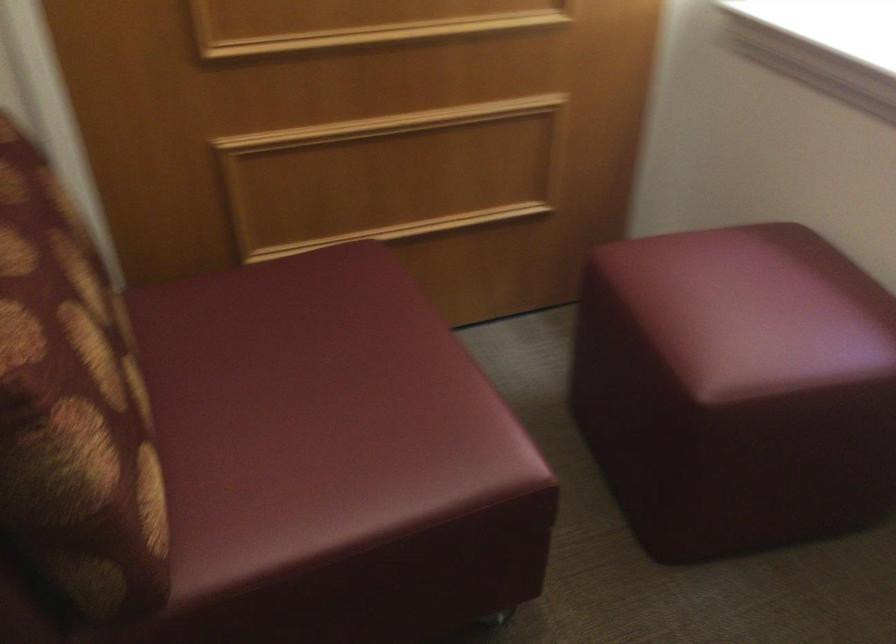
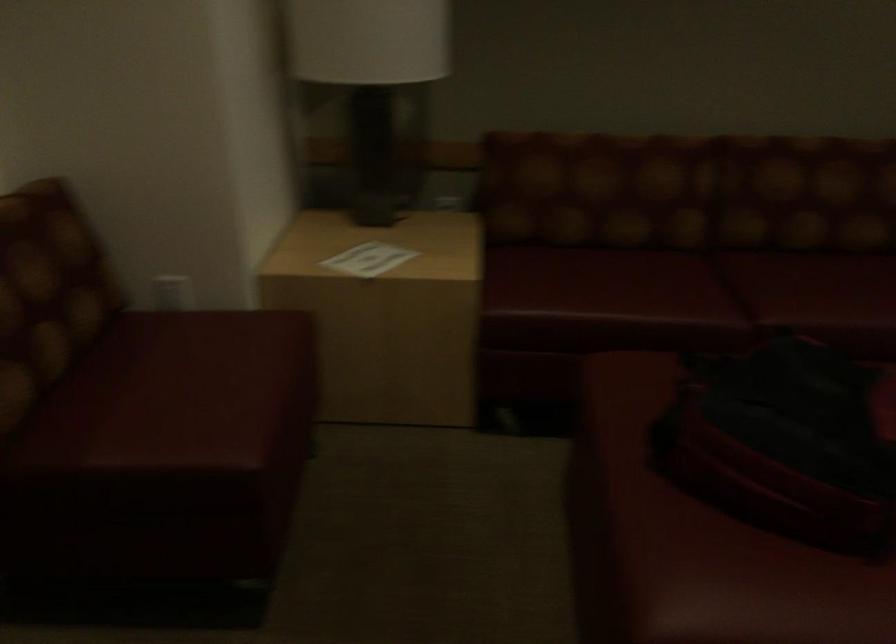
In a continuous first-person perspective shot, in which direction is the camera moving?

The movement direction of the cameraman is left, backward.